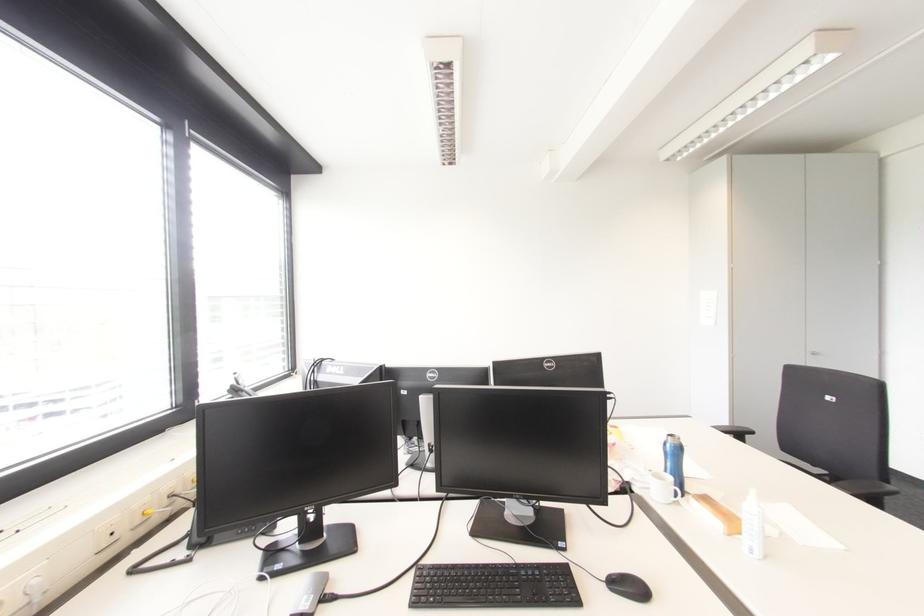
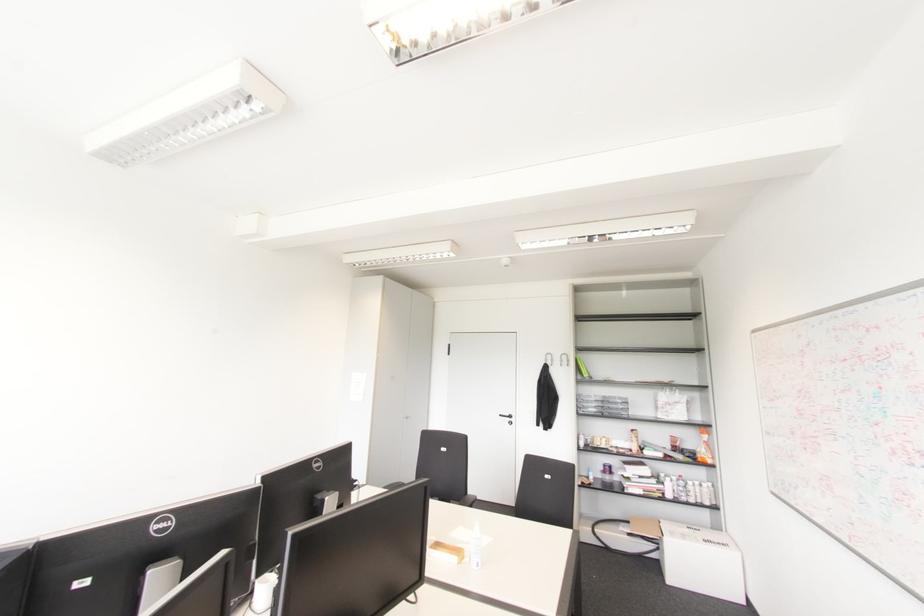
Question: The first image is from the beginning of the video and the second image is from the end. How did the camera likely rotate when shooting the video?

Choices:
 (A) Left
 (B) Right
 (C) Up
 (D) Down

Answer: (B)